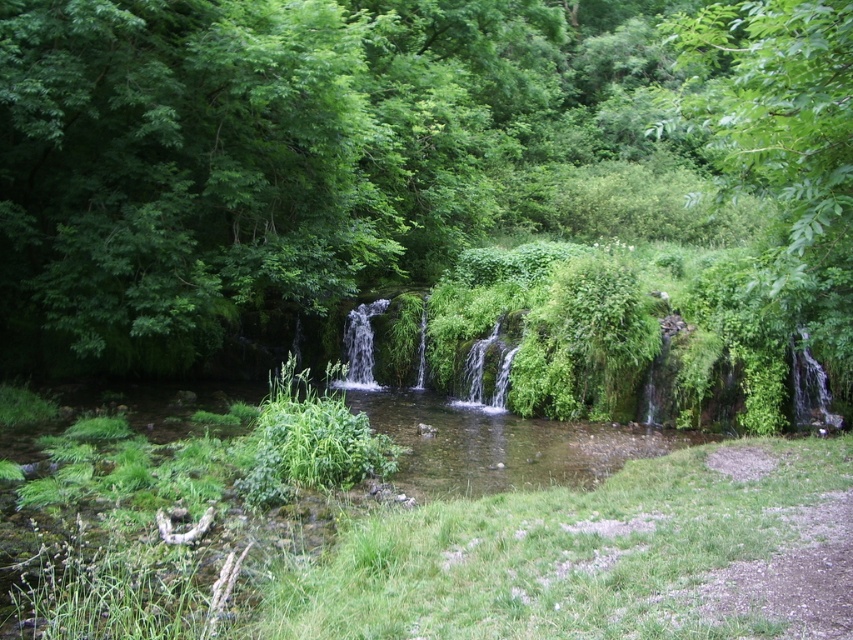
You are a hiker who wants to take a photo of the green leafy tree at upper right without the green leafy tree at center blocking the view. Which direction should you move to achieve this?

The green leafy tree at center is below the green leafy tree at upper right. To avoid the lower tree blocking the view, move to a higher elevation or position yourself above the green leafy tree at center so that the green leafy tree at upper right is visible without obstruction.

You are standing at the point marked by point (425, 180) in the image. Which direction should you walk to reach the green leafy tree at center?

The point (425, 180) is the location of the green leafy tree at center, so you are already at the tree.